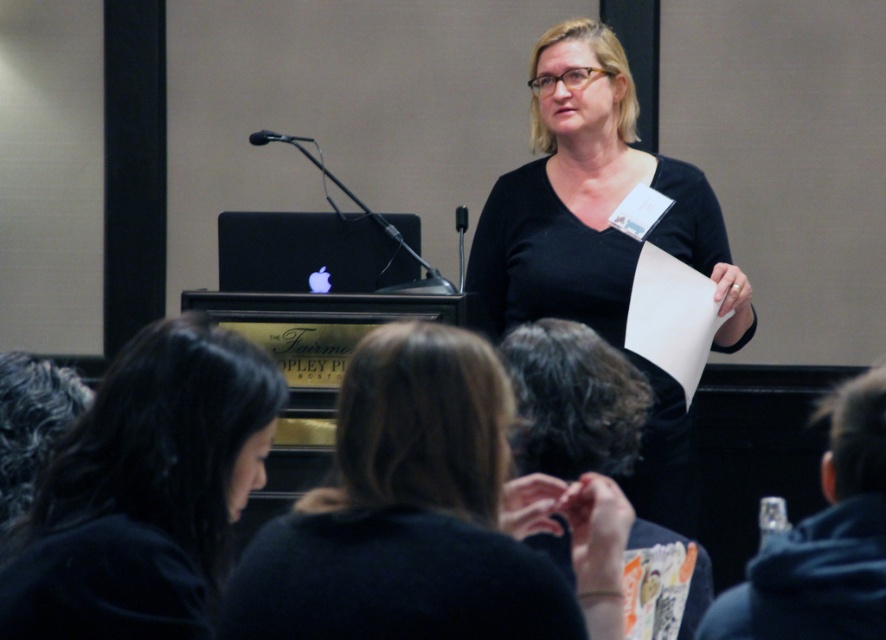
Question: Where is black fabric at lower right located in relation to black metallic microphone at upper center in the image?

Choices:
 (A) below
 (B) above

Answer: (A)

Question: Considering the real-world distances, which object is farthest from the dark curly hair at lower center?

Choices:
 (A) black fabric at lower right
 (B) black matte shirt at upper center
 (C) dark brown hair at lower left
 (D) black metallic microphone at upper center

Answer: (D)

Question: Which point is farther to the camera?

Choices:
 (A) black matte shirt at center
 (B) dark curly hair at lower center
 (C) gray curly hair at upper left
 (D) dark brown hair at lower left

Answer: (A)

Question: Does black matte shirt at upper center appear under gray curly hair at upper left?

Choices:
 (A) no
 (B) yes

Answer: (B)

Question: Which object is closer to the camera taking this photo?

Choices:
 (A) black matte shirt at upper center
 (B) dark brown hair at lower left
 (C) black matte shirt at center

Answer: (A)

Question: Can you confirm if gray curly hair at upper left is positioned above black metallic microphone at upper center?

Choices:
 (A) yes
 (B) no

Answer: (B)